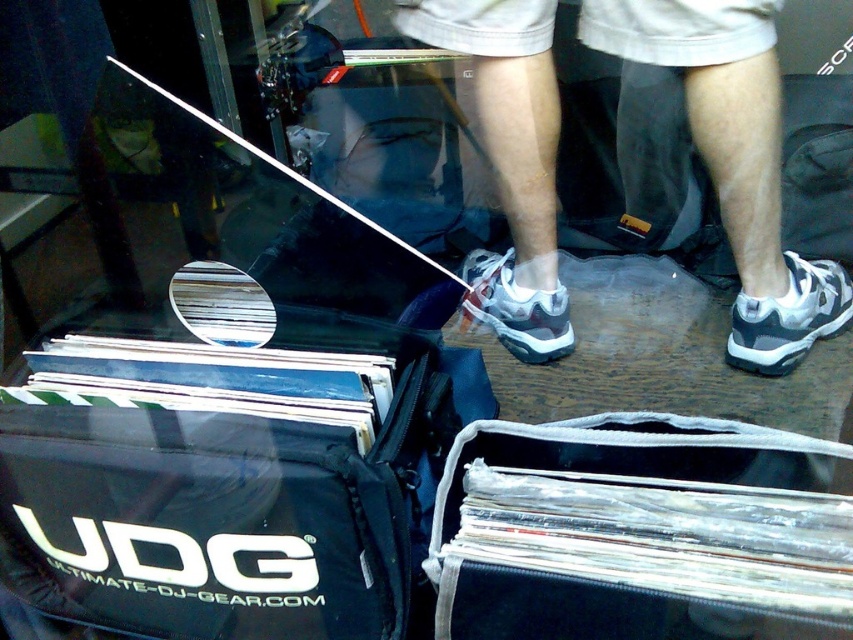
Question: Among these objects, which one is farthest from the camera?

Choices:
 (A) white mesh sneaker at lower right
 (B) white mesh sneaker at center

Answer: (B)

Question: Does black fabric bag at lower left appear on the left side of clear plastic vinyl records at lower center?

Choices:
 (A) yes
 (B) no

Answer: (A)

Question: Which point appears closest to the camera in this image?

Choices:
 (A) pyautogui.click(x=732, y=170)
 (B) pyautogui.click(x=850, y=284)
 (C) pyautogui.click(x=550, y=308)

Answer: (A)

Question: Is black fabric bag at lower left above white athletic shoe at center?

Choices:
 (A) yes
 (B) no

Answer: (B)

Question: Which point is farther to the camera?

Choices:
 (A) (828, 298)
 (B) (86, 413)
 (C) (561, 342)
 (D) (720, 173)

Answer: (C)

Question: Can you confirm if black fabric bag at lower left is smaller than white athletic shoe at center?

Choices:
 (A) yes
 (B) no

Answer: (A)